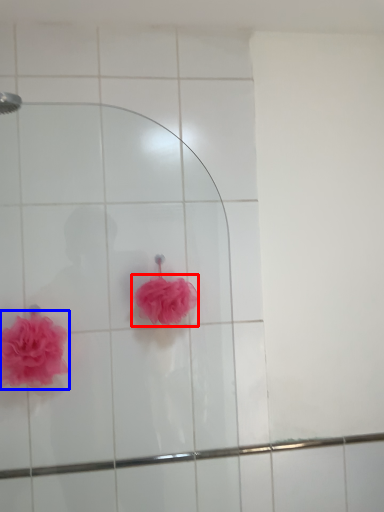
Question: Among these objects, which one is nearest to the camera, flower (highlighted by a red box) or flower (highlighted by a blue box)?

Choices:
 (A) flower
 (B) flower

Answer: (B)